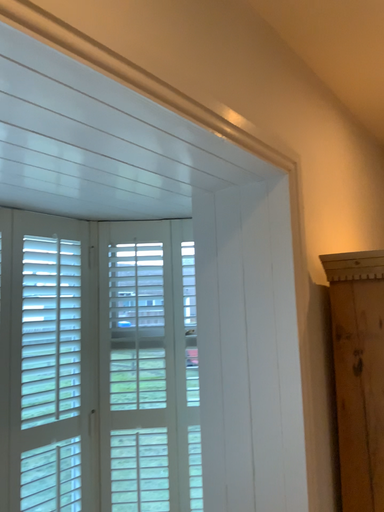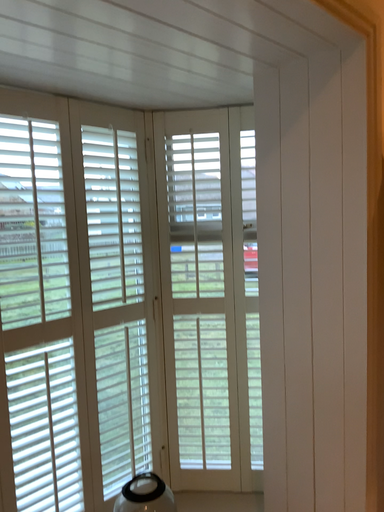
Question: How did the camera likely rotate when shooting the video?

Choices:
 (A) rotated downward
 (B) rotated upward

Answer: (A)